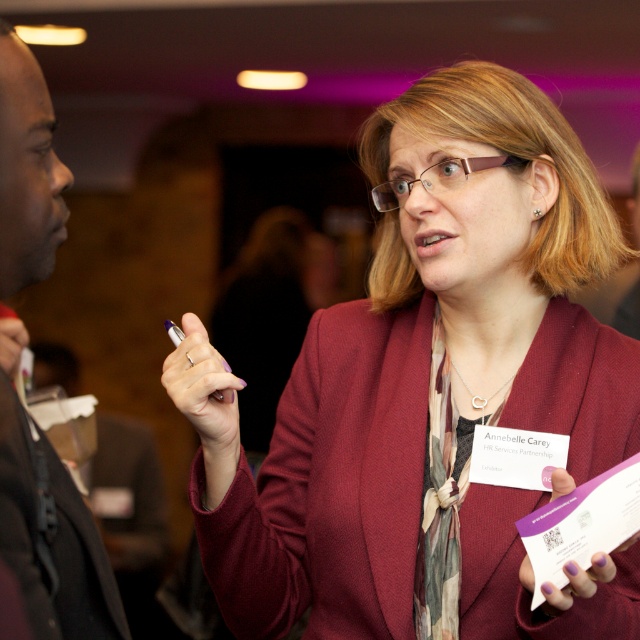
Does purple matte pen at center appear under purple matte card at center?

Actually, purple matte pen at center is above purple matte card at center.

Can you confirm if purple matte pen at center is smaller than purple matte card at center?

No.

Find the location of a particular element. This screenshot has height=640, width=640. purple matte pen at center is located at coordinates (204, 387).

The height and width of the screenshot is (640, 640). I want to click on purple matte pen at center, so click(204, 387).

Is maroon fabric coat at center further to camera compared to purple matte card at center?

Yes, it is.

Does maroon fabric coat at center appear on the left side of purple matte card at center?

Correct, you'll find maroon fabric coat at center to the left of purple matte card at center.

Is point (378, 600) positioned behind point (556, 472)?

Yes, it is.

The image size is (640, 640). What are the coordinates of `maroon fabric coat at center` in the screenshot? It's located at (440, 390).

Describe the element at coordinates (49, 525) in the screenshot. I see `black fabric suit at left` at that location.

Looking at this image, is black fabric suit at left thinner than purple matte card at center?

Yes, black fabric suit at left is thinner than purple matte card at center.

The image size is (640, 640). I want to click on black fabric suit at left, so click(49, 525).

Locate an element on the screen. The width and height of the screenshot is (640, 640). black fabric suit at left is located at coordinates (49, 525).